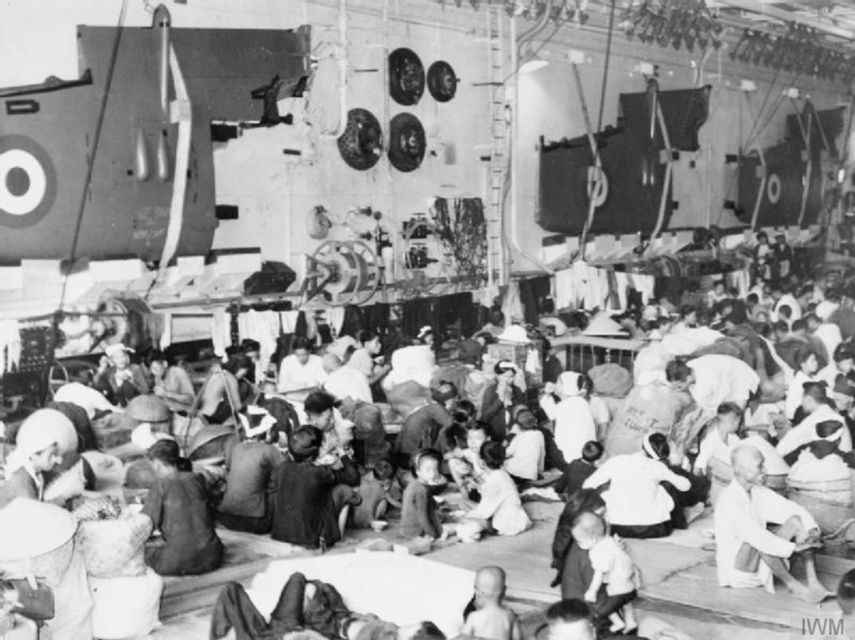
You are a photographer trying to capture a clear shot of the white cloth at center and the matte black clothing at center in the crowded scene. Since the crowd is dense, you need to know their positions relative to each other. Which object is positioned to the left of the other?

The matte black clothing at center is to the left of the white cloth at center.

You are a photographer taking a picture of the scene. You notice the matte black clothing at center and the white cloth baby at center. Which object should you focus on if you want to capture the larger one in your frame?

The matte black clothing at center is bigger than the white cloth baby at center, so you should focus on the matte black clothing at center to capture the larger one in your frame.

You are a photographer taking a picture of the scene. You notice the matte black clothing at center and the white cloth baby at center. Which object should you adjust your camera focus on first if you want to ensure both are in frame but the one closer to you is sharp?

The matte black clothing at center is to the left of white cloth baby at center, so you should focus on the white cloth baby at center first since it is closer to you.